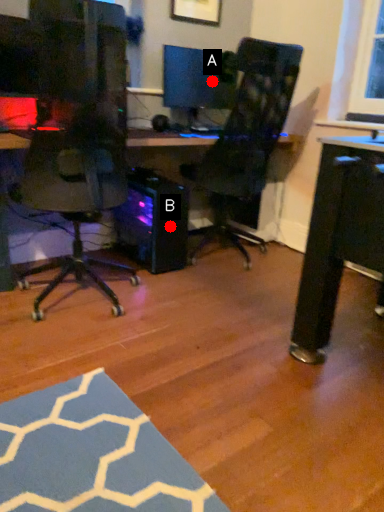
Question: Two points are circled on the image, labeled by A and B beside each circle. Among these points, which one is nearest to the camera?

Choices:
 (A) A is closer
 (B) B is closer

Answer: (B)